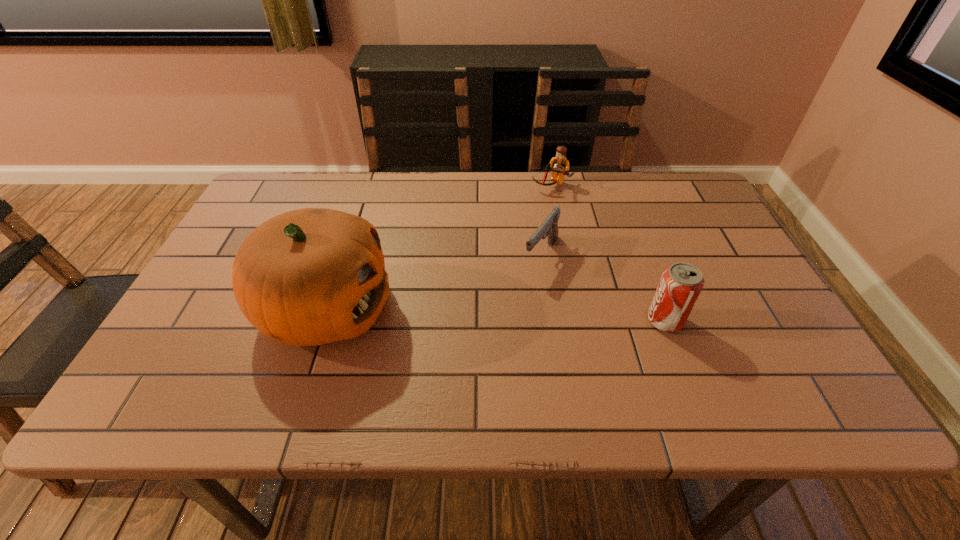
I want to click on vacant space on the desktop that is between the leftmost object and the rightmost object and is positioned holding a crossbow in the hands of the farthest object, so click(x=486, y=315).

Locate an element on the screen. The height and width of the screenshot is (540, 960). vacant spot on the desktop that is between the pumpkin and the soda can and is positioned at the barrel of the pistol is located at coordinates (496, 315).